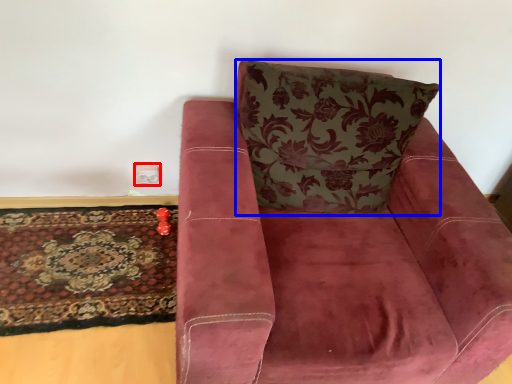
Question: Which of the following is the closest to the observer, electric outlet (highlighted by a red box) or throw pillow (highlighted by a blue box)?

Choices:
 (A) electric outlet
 (B) throw pillow

Answer: (B)